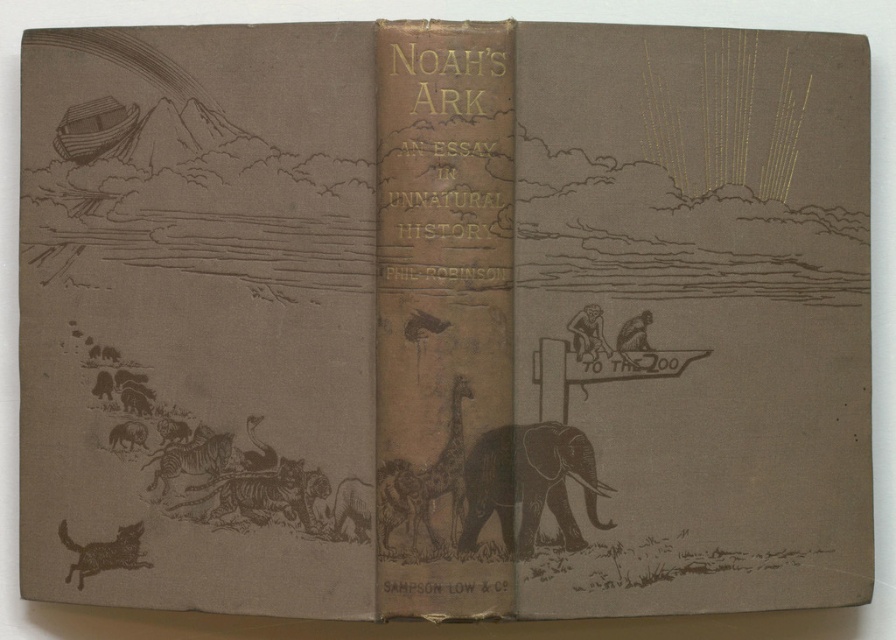
In the scene shown: Looking at the book cover, which animal is taller between the brown textured elephant at center and the brown textured dog at lower left?

The brown textured elephant at center is taller than the brown textured dog at lower left.

You are an art student analyzing the book cover. You notice the brown textured elephant at center and the brown textured dog at lower left. Which animal appears bigger on the cover?

The brown textured elephant at center is larger in size compared to the brown textured dog at lower left.

From the picture: You are an art student analyzing the book cover. The scene shows the brown textured elephant at center and the brown textured dog at lower left. Which animal is positioned closer to the middle of the cover?

The brown textured elephant at center is positioned closer to the middle of the cover than the brown textured dog at lower left.